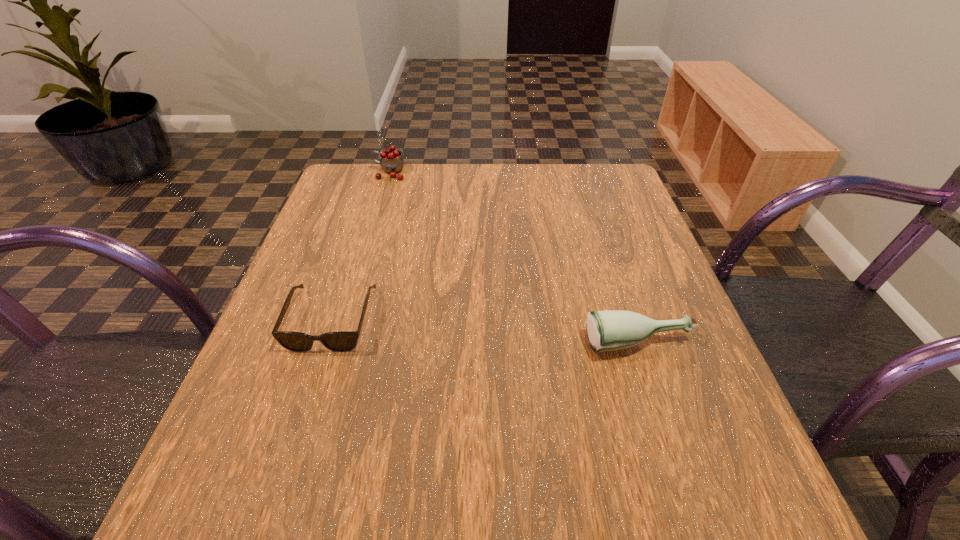
This screenshot has height=540, width=960. I want to click on vacant area between the tallest object and the rightmost object, so click(514, 258).

The width and height of the screenshot is (960, 540). What are the coordinates of `free area in between the rightmost object and the shortest object` in the screenshot? It's located at (485, 332).

Where is `object that is the second nearest to the second tallest object`? The width and height of the screenshot is (960, 540). object that is the second nearest to the second tallest object is located at coordinates (392, 162).

At what (x,y) coordinates should I click in order to perform the action: click on object that is the closest to the second shortest object. Please return your answer as a coordinate pair (x, y). Looking at the image, I should click on click(x=341, y=341).

Where is `vacant space that satisfies the following two spatial constraints: 1. at the front lenses of the second tallest object; 2. on the left side of the shortest object`? This screenshot has height=540, width=960. vacant space that satisfies the following two spatial constraints: 1. at the front lenses of the second tallest object; 2. on the left side of the shortest object is located at coordinates (324, 345).

I want to click on free location that satisfies the following two spatial constraints: 1. at the front lenses of the rightmost object; 2. on the right side of the shortest object, so click(324, 345).

The width and height of the screenshot is (960, 540). In order to click on vacant space that satisfies the following two spatial constraints: 1. at the front lenses of the shortest object; 2. on the left side of the rightmost object in this screenshot , I will do `click(324, 345)`.

Identify the location of vacant space that satisfies the following two spatial constraints: 1. at the front lenses of the bottle; 2. on the left side of the sunglasses. (324, 345).

At what (x,y) coordinates should I click in order to perform the action: click on free space that satisfies the following two spatial constraints: 1. at the front lenses of the rightmost object; 2. on the left side of the sunglasses. Please return your answer as a coordinate pair (x, y). Image resolution: width=960 pixels, height=540 pixels. Looking at the image, I should click on (324, 345).

The image size is (960, 540). In order to click on vacant space that satisfies the following two spatial constraints: 1. at the front lenses of the shortest object; 2. on the left side of the rightmost object in this screenshot , I will do `click(324, 345)`.